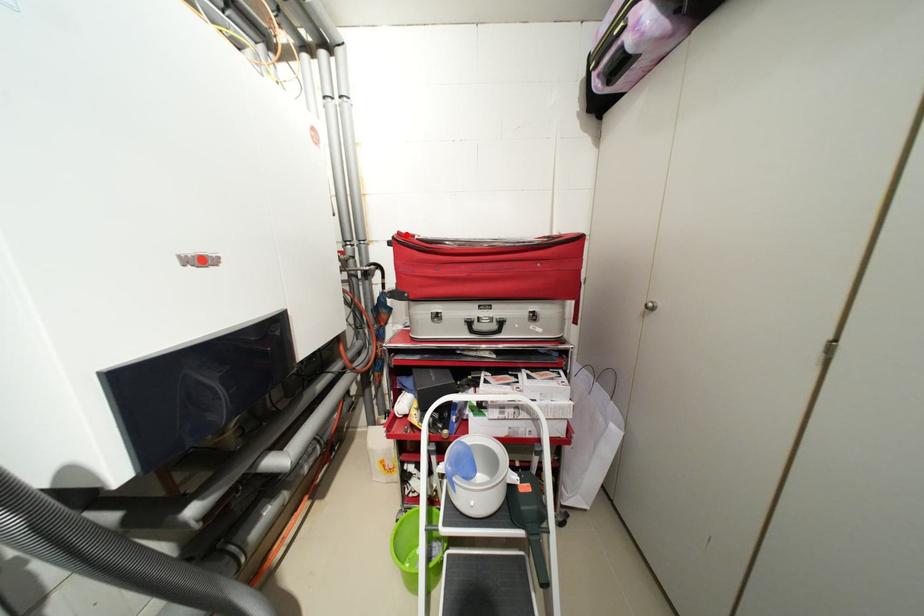
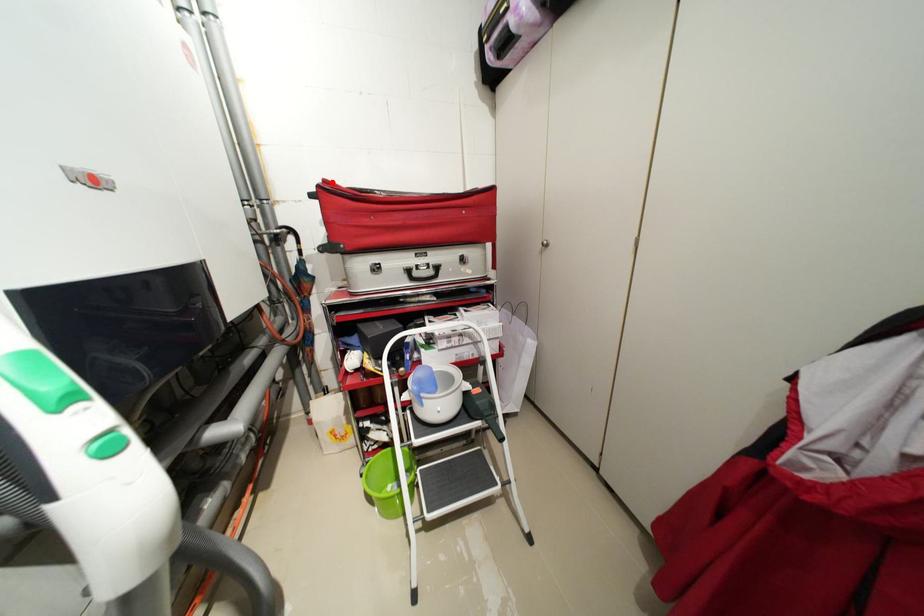
I am providing you with two images of the same scene from different viewpoints. A red point is marked on the first image and another point is marked on the second image. Is the marked point in image1 the same physical position as the marked point in image2?

Yes